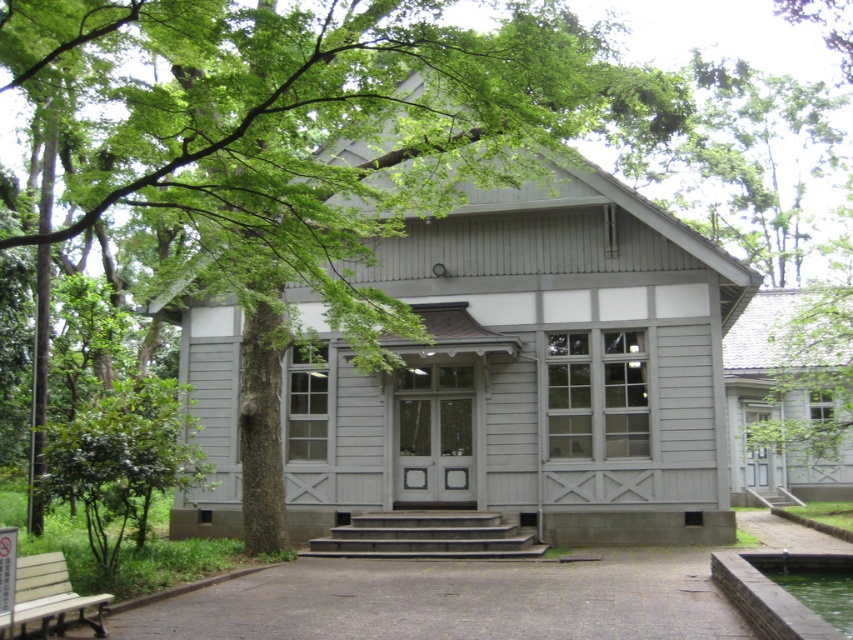
What do you see at coordinates (317, 154) in the screenshot? I see `green leafy tree at center` at bounding box center [317, 154].

Does green leafy tree at center have a lesser height compared to concrete steps at center?

In fact, green leafy tree at center may be taller than concrete steps at center.

Describe the element at coordinates (317, 154) in the screenshot. I see `green leafy tree at center` at that location.

The width and height of the screenshot is (853, 640). Find the location of `green leafy tree at center`. green leafy tree at center is located at coordinates (317, 154).

Does point (469, 515) come behind point (32, 605)?

Yes, it is.

Is point (405, 509) less distant than point (42, 577)?

That is False.

The height and width of the screenshot is (640, 853). Identify the location of concrete steps at center. (426, 536).

Can you confirm if green leafy tree at center is positioned below wooden bench at lower left?

Actually, green leafy tree at center is above wooden bench at lower left.

Which is below, green leafy tree at center or wooden bench at lower left?

wooden bench at lower left is lower down.

Identify the location of green leafy tree at center. tap(317, 154).